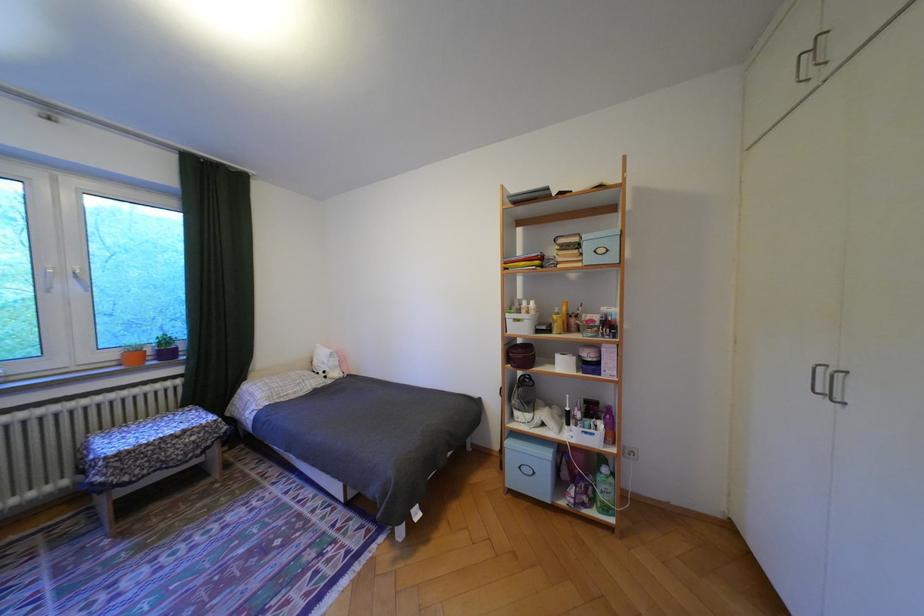
In order to click on toilet paper roll in this screenshot , I will do `click(566, 363)`.